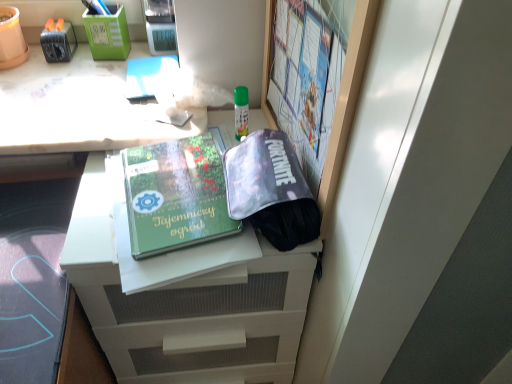
Locate an element on the screen. This screenshot has height=384, width=512. green matte book at center is located at coordinates (176, 195).

How much space does green plastic pen holder at upper left, the first stationery positioned from the right, occupy vertically?

The height of green plastic pen holder at upper left, the first stationery positioned from the right, is 4.62 inches.

Image resolution: width=512 pixels, height=384 pixels. What do you see at coordinates (346, 103) in the screenshot?
I see `matte plastic bulletin board at upper right` at bounding box center [346, 103].

In order to face white glossy desk at upper left, should I rotate leftwards or rightwards?

To face it directly, rotate left by 21.359 degrees.

Find the location of `green matte book at center`. green matte book at center is located at coordinates (176, 195).

Does matte black tape dispenser at upper left, which ranks as the 1th stationery in left-to-right order, touch translucent purple pouch at center?

matte black tape dispenser at upper left, which ranks as the 1th stationery in left-to-right order, is not next to translucent purple pouch at center, and they're not touching.

From a real-world perspective, is matte black tape dispenser at upper left, which ranks as the 1th stationery in left-to-right order, positioned above or below translucent purple pouch at center?

From a real-world perspective, matte black tape dispenser at upper left, which ranks as the 1th stationery in left-to-right order, is physically above translucent purple pouch at center.

Choose the correct answer: Is matte black tape dispenser at upper left, which ranks as the 2th stationery in right-to-left order, inside translucent purple pouch at center or outside it?

matte black tape dispenser at upper left, which ranks as the 2th stationery in right-to-left order, is spatially situated outside translucent purple pouch at center.

Is matte black tape dispenser at upper left, which ranks as the 2th stationery in right-to-left order, positioned with its back to translucent purple pouch at center?

That's not correct — matte black tape dispenser at upper left, which ranks as the 2th stationery in right-to-left order, is not looking away from translucent purple pouch at center.

Where is `bulletin board in front of the white glossy desk at upper left`? The height and width of the screenshot is (384, 512). bulletin board in front of the white glossy desk at upper left is located at coordinates (346, 103).

From a real-world perspective, who is located higher, matte plastic bulletin board at upper right or white glossy desk at upper left?

matte plastic bulletin board at upper right, from a real-world perspective.

From the image's perspective, which is below, matte plastic bulletin board at upper right or white glossy desk at upper left?

From the image's view, matte plastic bulletin board at upper right is below.

Is matte plastic bulletin board at upper right further to camera compared to white glossy desk at upper left?

That is False.

Which is in front, point (274, 178) or point (65, 76)?

Point (274, 178)

Considering the relative positions of translucent purple pouch at center and white glossy desk at upper left in the image provided, is translucent purple pouch at center to the right of white glossy desk at upper left from the viewer's perspective?

Yes, translucent purple pouch at center is to the right of white glossy desk at upper left.

Consider the image. Does translucent purple pouch at center have a greater height compared to white glossy desk at upper left?

Yes, translucent purple pouch at center is taller than white glossy desk at upper left.

Is translucent purple pouch at center not near white matte file cabinet at center?

Actually, translucent purple pouch at center and white matte file cabinet at center are a little close together.

Between translucent purple pouch at center and white matte file cabinet at center, which one has smaller size?

With smaller size is translucent purple pouch at center.

Looking at this image, would you say translucent purple pouch at center is to the left or to the right of white matte file cabinet at center in the picture?

Based on their positions, translucent purple pouch at center is located to the right of white matte file cabinet at center.

Which is nearer, (x=232, y=216) or (x=142, y=358)?

Clearly, point (x=232, y=216) is closer to the camera than point (x=142, y=358).

Measure the distance between matte plastic bulletin board at upper right and white matte file cabinet at center.

The distance of matte plastic bulletin board at upper right from white matte file cabinet at center is 12.92 inches.

Can you confirm if matte plastic bulletin board at upper right is smaller than white matte file cabinet at center?

Yes.

From a real-world perspective, between matte plastic bulletin board at upper right and white matte file cabinet at center, who is vertically lower?

From a 3D spatial view, white matte file cabinet at center is below.

Who is taller, matte plastic bulletin board at upper right or white matte file cabinet at center?

Standing taller between the two is white matte file cabinet at center.

Locate an element on the screen. The width and height of the screenshot is (512, 384). the 2nd stationery directly beneath the matte plastic bulletin board at upper right (from a real-world perspective) is located at coordinates (58, 41).

From a real-world perspective, who is located higher, matte black tape dispenser at upper left, which ranks as the 1th stationery in left-to-right order, or matte plastic bulletin board at upper right?

matte plastic bulletin board at upper right, from a real-world perspective.

How far apart are matte black tape dispenser at upper left, which ranks as the 1th stationery in left-to-right order, and matte plastic bulletin board at upper right?

31.58 inches.

Locate an element on the screen. This screenshot has width=512, height=384. bulletin board above the translucent purple pouch at center (from a real-world perspective) is located at coordinates (346, 103).

Could you measure the distance between matte plastic bulletin board at upper right and translucent purple pouch at center?

4.12 inches.

Is there a large distance between matte plastic bulletin board at upper right and translucent purple pouch at center?

No, there isn't a large distance between matte plastic bulletin board at upper right and translucent purple pouch at center.

Which of these two, matte plastic bulletin board at upper right or translucent purple pouch at center, is smaller?

translucent purple pouch at center is smaller.

Image resolution: width=512 pixels, height=384 pixels. I want to click on bag lying in front of the matte black tape dispenser at upper left, which ranks as the 1th stationery in left-to-right order, so click(x=271, y=190).

Where is `desk above the matte plastic bulletin board at upper right (from the image's perspective)`? This screenshot has width=512, height=384. desk above the matte plastic bulletin board at upper right (from the image's perspective) is located at coordinates (75, 108).

Considering their positions, is white matte file cabinet at center positioned further to translucent purple pouch at center than green plastic pen holder at upper left, which is counted as the second stationery, starting from the left?

Based on the image, green plastic pen holder at upper left, which is counted as the second stationery, starting from the left, appears to be further to translucent purple pouch at center.

Considering their positions, is white glossy desk at upper left positioned further to matte black tape dispenser at upper left, which ranks as the 1th stationery in left-to-right order, than white matte file cabinet at center?

The object further to matte black tape dispenser at upper left, which ranks as the 1th stationery in left-to-right order, is white matte file cabinet at center.

Looking at the image, which one is located closer to white matte file cabinet at center, green matte book at center or matte plastic bulletin board at upper right?

green matte book at center.

Based on their spatial positions, is translucent purple pouch at center or green plastic pen holder at upper left, the first stationery positioned from the right, closer to green matte book at center?

translucent purple pouch at center.

Consider the image. Based on their spatial positions, is translucent purple pouch at center or green matte book at center closer to green plastic pen holder at upper left, which is counted as the second stationery, starting from the left?

green matte book at center is closer to green plastic pen holder at upper left, which is counted as the second stationery, starting from the left.

Considering their positions, is translucent purple pouch at center positioned closer to green matte book at center than white matte file cabinet at center?

translucent purple pouch at center is positioned closer to the anchor green matte book at center.

When comparing their distances from white matte file cabinet at center, does matte plastic bulletin board at upper right or matte black tape dispenser at upper left, which ranks as the 1th stationery in left-to-right order, seem closer?

matte plastic bulletin board at upper right lies closer to white matte file cabinet at center than the other object.

Based on their spatial positions, is matte plastic bulletin board at upper right or white glossy desk at upper left closer to green plastic pen holder at upper left, which is counted as the second stationery, starting from the left?

Among the two, white glossy desk at upper left is located nearer to green plastic pen holder at upper left, which is counted as the second stationery, starting from the left.

This screenshot has width=512, height=384. Find the location of `stationery between matte black tape dispenser at upper left, which ranks as the 2th stationery in right-to-left order, and translucent purple pouch at center from left to right`. stationery between matte black tape dispenser at upper left, which ranks as the 2th stationery in right-to-left order, and translucent purple pouch at center from left to right is located at coordinates (106, 35).

The image size is (512, 384). What are the coordinates of `paperback book that lies between matte black tape dispenser at upper left, which ranks as the 2th stationery in right-to-left order, and white matte file cabinet at center from top to bottom` in the screenshot? It's located at (176, 195).

Locate an element on the screen. bag located between white glossy desk at upper left and matte plastic bulletin board at upper right in the left-right direction is located at coordinates (271, 190).

Locate an element on the screen. This screenshot has width=512, height=384. paperback book between translucent purple pouch at center and white matte file cabinet at center in the vertical direction is located at coordinates (176, 195).